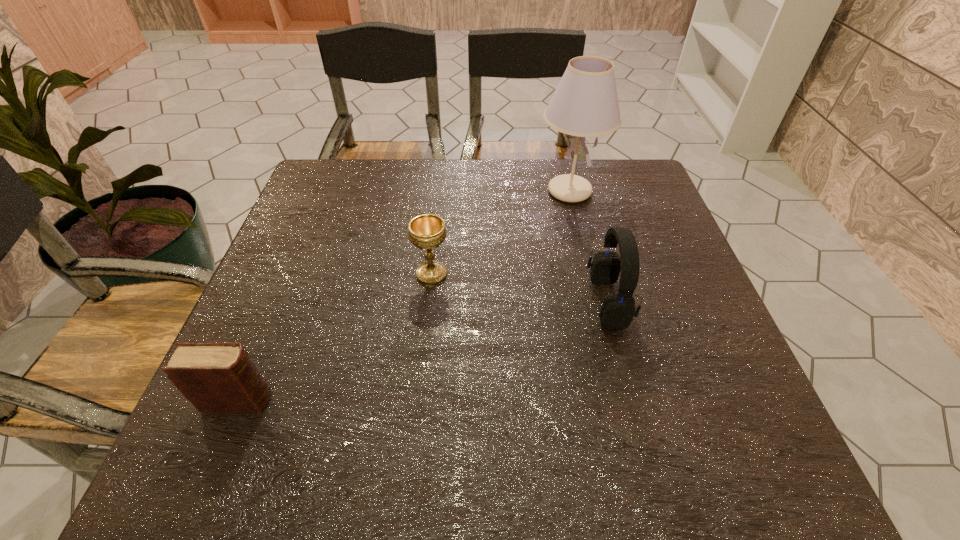
At what (x,y) coordinates should I click in order to perform the action: click on vacant space located 0.120m on the left of the chalice. Please return your answer as a coordinate pair (x, y). Looking at the image, I should click on (362, 274).

Locate an element on the screen. vacant space located 0.360m on the spine side of the diary is located at coordinates (474, 401).

Locate an element on the screen. The image size is (960, 540). object situated at the far edge is located at coordinates (585, 104).

Where is `object located in the left edge section of the desktop`? This screenshot has height=540, width=960. object located in the left edge section of the desktop is located at coordinates (215, 377).

The image size is (960, 540). Identify the location of object that is at the right edge. (585, 104).

Identify the location of object that is at the far right corner. The image size is (960, 540). (585, 104).

Where is `vacant space at the far edge of the desktop`? Image resolution: width=960 pixels, height=540 pixels. vacant space at the far edge of the desktop is located at coordinates (462, 191).

In the image, there is a desktop. At what (x,y) coordinates should I click in order to perform the action: click on blank space at the near edge. Please return your answer as a coordinate pair (x, y). This screenshot has width=960, height=540. Looking at the image, I should click on (598, 475).

This screenshot has height=540, width=960. In order to click on vacant space at the left edge of the desktop in this screenshot , I will do `click(310, 317)`.

The width and height of the screenshot is (960, 540). Find the location of `vacant position at the right edge of the desktop`. vacant position at the right edge of the desktop is located at coordinates (708, 357).